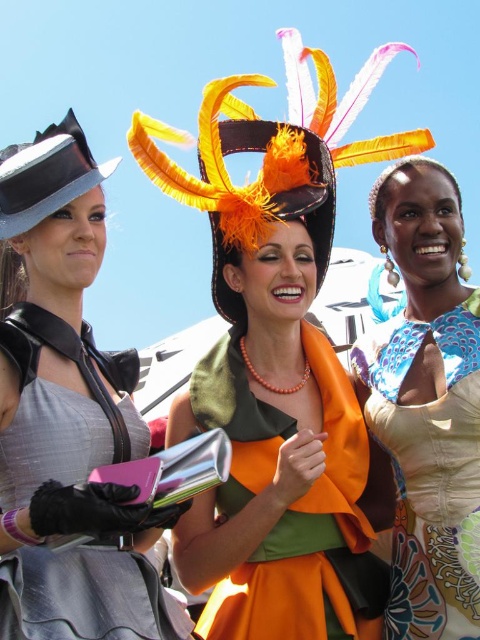
Question: Which point is closer to the camera taking this photo?

Choices:
 (A) (279, 164)
 (B) (212, 595)
 (C) (98, 387)

Answer: (B)

Question: Which point is farther from the camera taking this photo?

Choices:
 (A) pos(252,193)
 (B) pos(49,426)

Answer: (A)

Question: Estimate the real-world distances between objects in this image. Which object is farther from the orange feathered hat at center?

Choices:
 (A) orange matte fabric dress at center
 (B) matte black dress at left

Answer: (A)

Question: Is matte black dress at left behind matte black hat at left?

Choices:
 (A) no
 (B) yes

Answer: (A)

Question: Does matte orange dress at center lie behind orange feathered hat at center?

Choices:
 (A) no
 (B) yes

Answer: (A)

Question: Does matte orange dress at center lie in front of matte black hat at left?

Choices:
 (A) yes
 (B) no

Answer: (A)